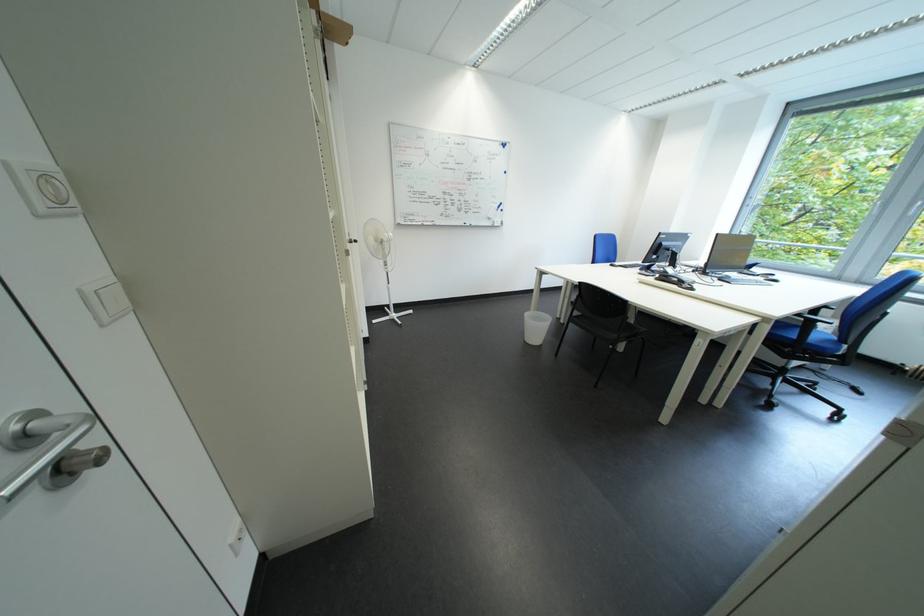
Image resolution: width=924 pixels, height=616 pixels. Describe the element at coordinates (49, 450) in the screenshot. I see `the silver door handle` at that location.